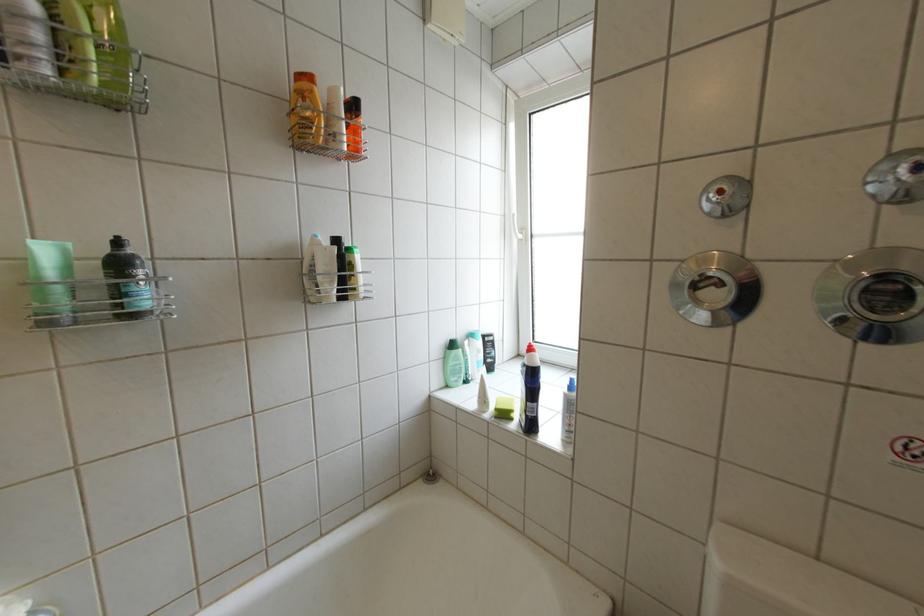
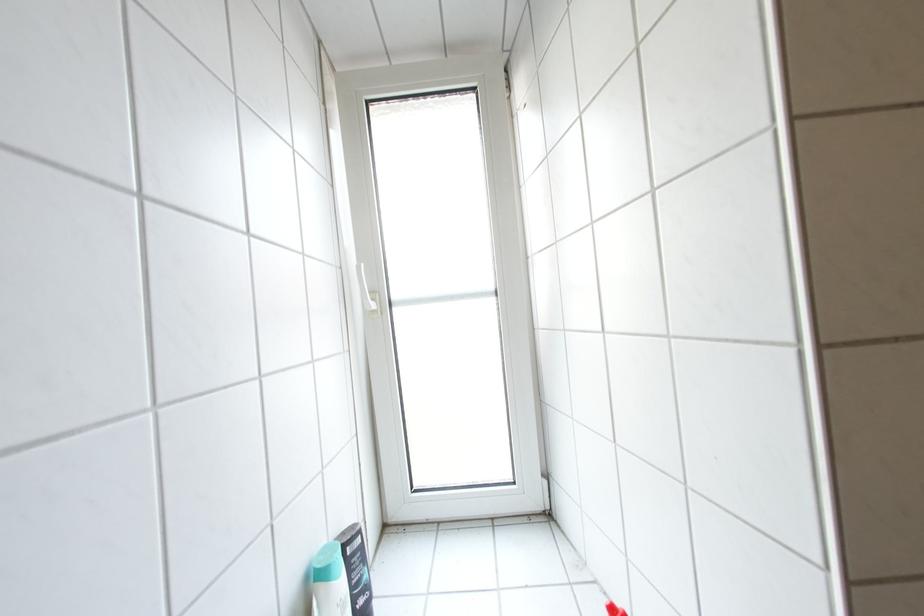
Question: The camera is either moving clockwise (left) or counter-clockwise (right) around the object. The first image is from the beginning of the video and the second image is from the end. Is the camera moving left or right when shooting the video?

Choices:
 (A) Left
 (B) Right

Answer: (A)